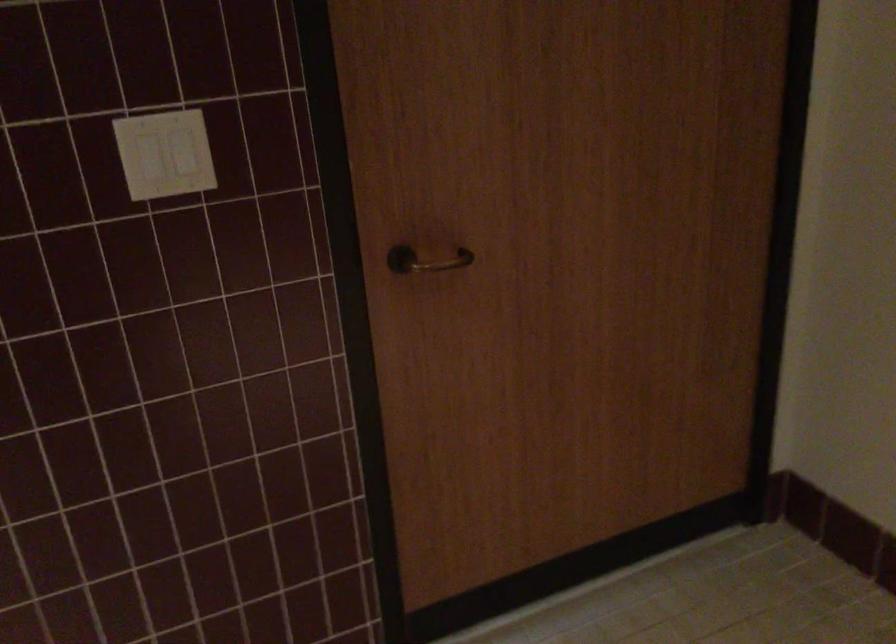
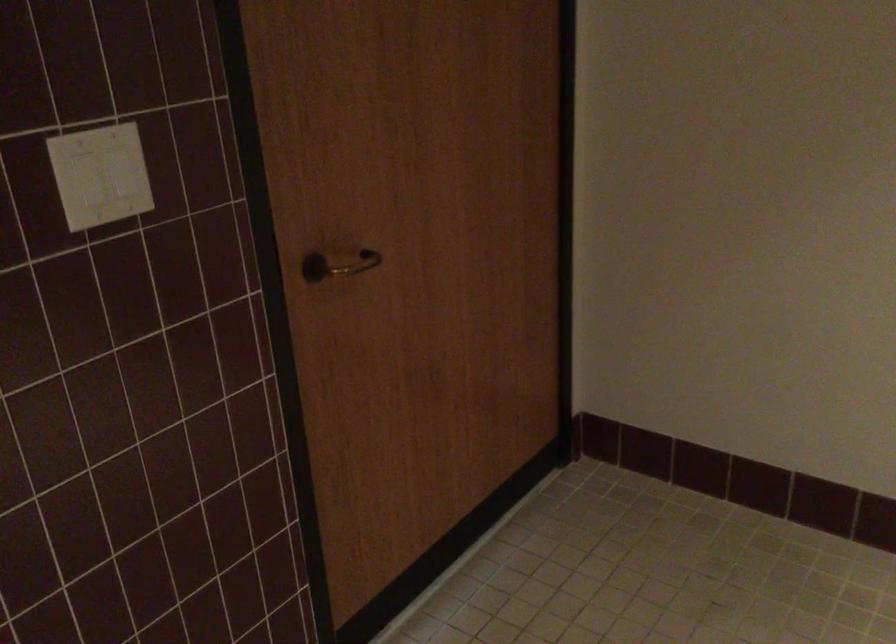
Where in the second image is the point corresponding to the point at 161,151 from the first image?

(101, 175)